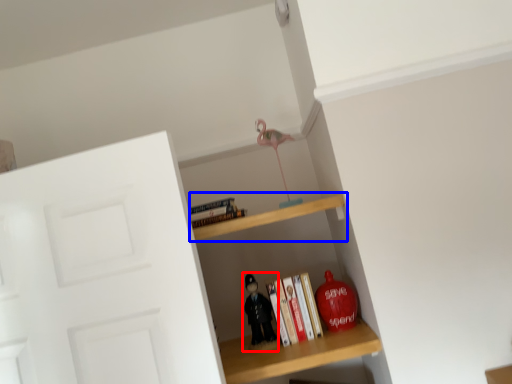
Question: Which point is closer to the camera, toy (highlighted by a red box) or shelf (highlighted by a blue box)?

Choices:
 (A) toy
 (B) shelf

Answer: (B)